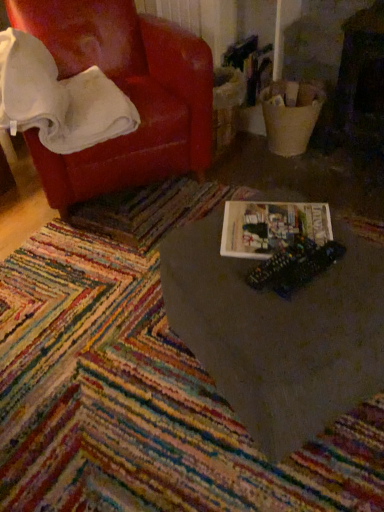
Question: Could white glossy book at center be considered to be inside white soft blanket at upper left?

Choices:
 (A) no
 (B) yes

Answer: (A)

Question: From the image's perspective, is white soft blanket at upper left below white glossy book at center?

Choices:
 (A) yes
 (B) no

Answer: (B)

Question: Considering the relative sizes of white soft blanket at upper left and white glossy book at center in the image provided, is white soft blanket at upper left wider than white glossy book at center?

Choices:
 (A) no
 (B) yes

Answer: (B)

Question: Is white soft blanket at upper left not within white glossy book at center?

Choices:
 (A) yes
 (B) no

Answer: (A)

Question: Does white soft blanket at upper left have a lesser height compared to white glossy book at center?

Choices:
 (A) yes
 (B) no

Answer: (B)

Question: From the image's perspective, would you say white soft blanket at upper left is positioned over white glossy book at center?

Choices:
 (A) yes
 (B) no

Answer: (A)

Question: Is there a large distance between hardcover book at center and leather-like red armchair at upper left?

Choices:
 (A) no
 (B) yes

Answer: (A)

Question: Can you confirm if hardcover book at center is shorter than leather-like red armchair at upper left?

Choices:
 (A) no
 (B) yes

Answer: (B)

Question: Does hardcover book at center have a lesser width compared to leather-like red armchair at upper left?

Choices:
 (A) no
 (B) yes

Answer: (B)

Question: Is hardcover book at center in front of leather-like red armchair at upper left?

Choices:
 (A) yes
 (B) no

Answer: (A)

Question: From a real-world perspective, is hardcover book at center beneath leather-like red armchair at upper left?

Choices:
 (A) yes
 (B) no

Answer: (A)

Question: From a real-world perspective, is hardcover book at center physically above leather-like red armchair at upper left?

Choices:
 (A) yes
 (B) no

Answer: (B)

Question: From a real-world perspective, is white soft blanket at upper left below hardcover book at center?

Choices:
 (A) no
 (B) yes

Answer: (A)